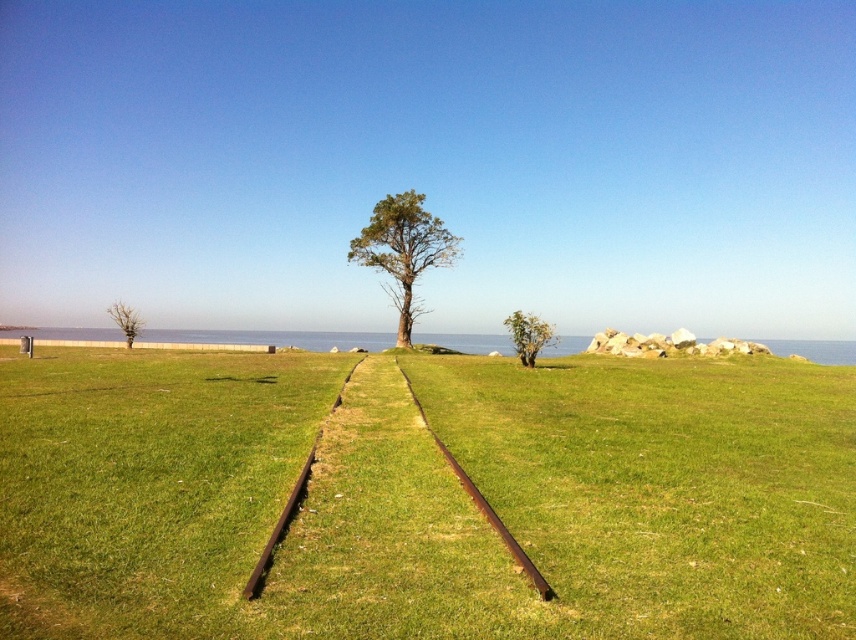
You are standing on the railway tracks and looking towards the green leafy tree at right. Which direction should you walk to reach the green grassy at center?

The green grassy at center is positioned under the green leafy tree at right, so you should walk towards the base of the tree to reach the green grassy at center.

You are standing at the starting point of the railway tracks in the foreground. You want to walk towards the green leafy tree at center. Which direction should you head relative to the railway tracks?

The green leafy tree at center is located at point (403, 252), which means it is positioned along the central axis between the two parallel railway tracks. Therefore, you should walk straight ahead along the tracks towards the horizon to reach the tree.

You are standing at the edge of the field and see the green grassy at center and the green leafy tree at lower left. Which object is closer to you?

The green leafy tree at lower left is closer to you since it is positioned lower in the image, which typically indicates proximity in perspective.